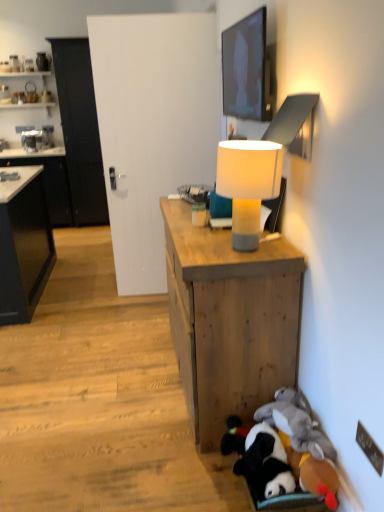
The height and width of the screenshot is (512, 384). I want to click on blank space situated above fluffy plush toys at lower right (from a real-world perspective), so click(x=281, y=456).